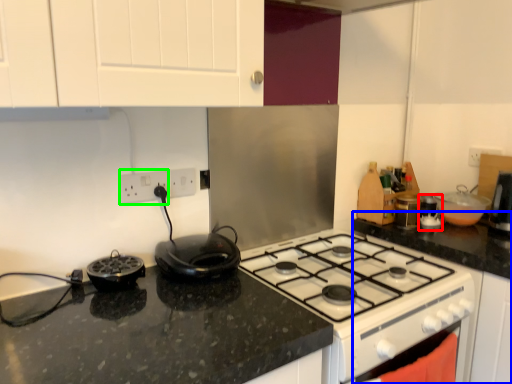
Question: Considering the real-world distances, which object is closest to appliance (highlighted by a red box)? counter top (highlighted by a blue box) or electric outlet (highlighted by a green box).

Choices:
 (A) counter top
 (B) electric outlet

Answer: (A)